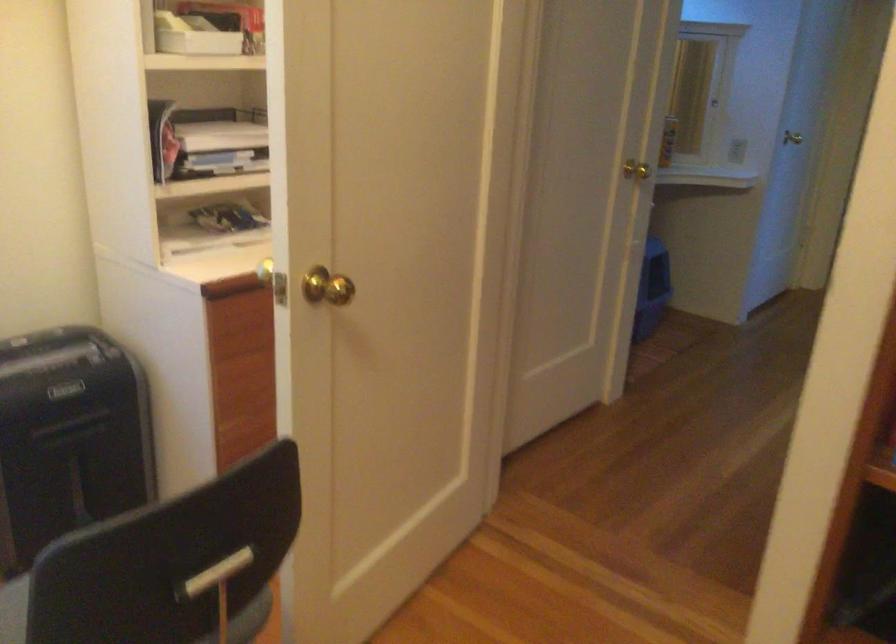
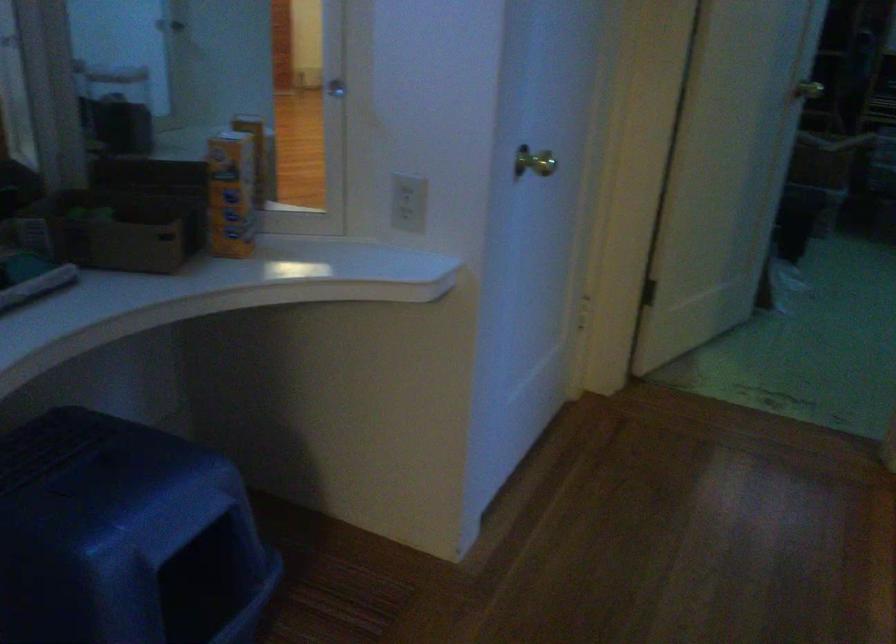
Find the pixel in the second image that matches the point at 796,134 in the first image.

(533, 162)